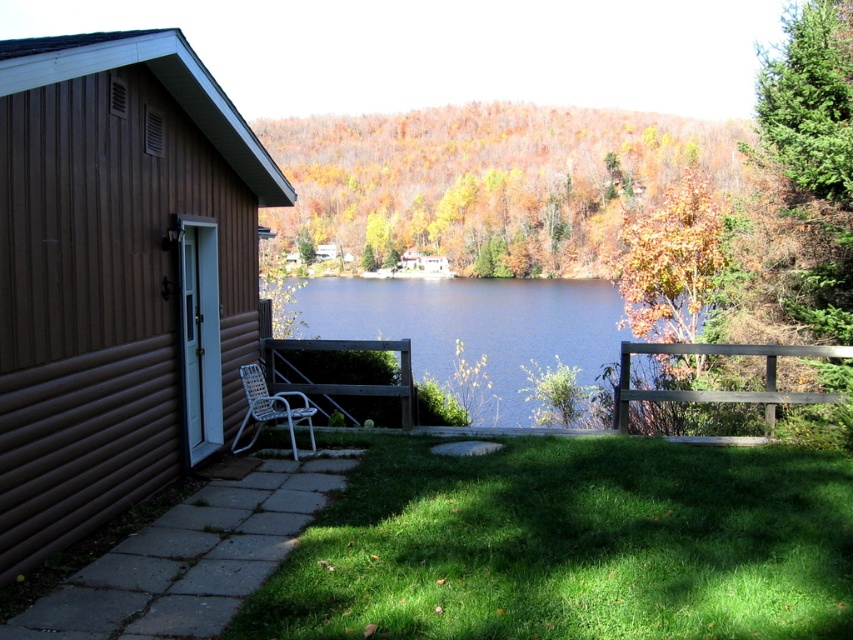
You are standing at the wooden cabin on the left side of the image and want to walk to the point labeled as point (791, 400). However, there is an obstacle at point (386, 349). Which point is closer to you, the obstacle or your destination?

Point (791, 400) is closer to the camera than point (386, 349), so the destination is closer to you than the obstacle.

Consider the image. You are a visitor at this cabin and want to sit on one of the benches. The brown wooden park bench at right and the wooden park bench at center are both available. Which bench is taller?

The brown wooden park bench at right is much taller than the wooden park bench at center.